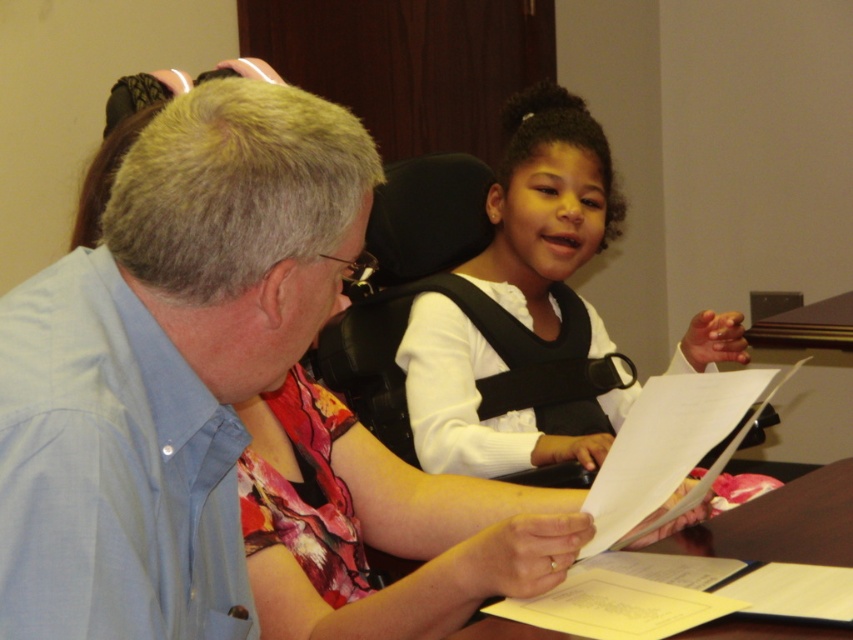
You are sitting at the brown wooden table at center and want to hand a document to the person wearing the light blue shirt at left. Which direction should you move to reach them?

You should move to your left because the light blue shirt at left is positioned to the left of the brown wooden table at center, so moving left from the table will bring you closer to them.

You are organizing a clothing donation drive and need to categorize items by size. You have a light blue shirt at left and a white matte vest at center. Which item is more likely to be a medium size?

The light blue shirt at left is thinner than the white matte vest at center, so the light blue shirt at left is more likely to be a medium size.